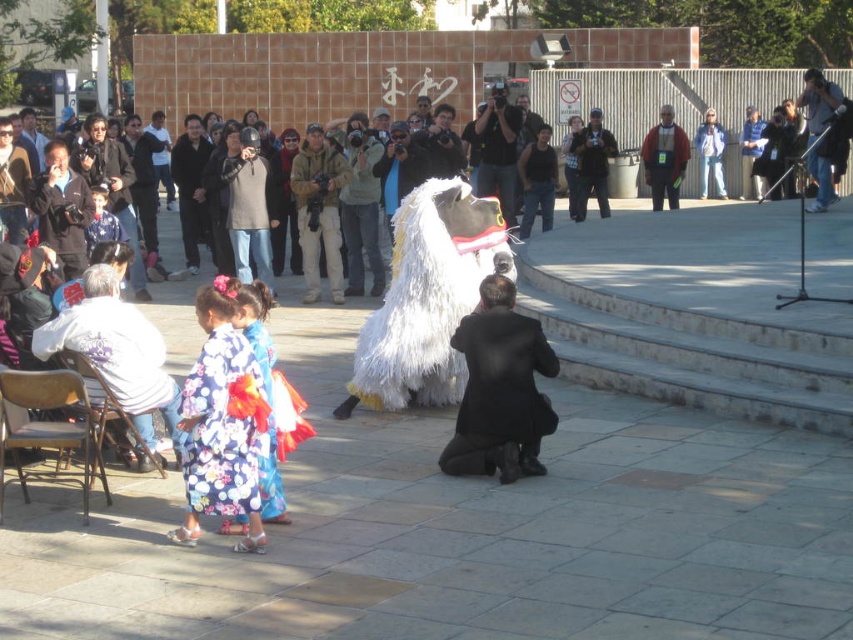
Is white fluffy animal at center shorter than matte black jacket at upper right?

No.

Which is in front, point (451, 378) or point (650, 173)?

Point (451, 378) is more forward.

Locate an element on the screen. Image resolution: width=853 pixels, height=640 pixels. white fluffy animal at center is located at coordinates (426, 298).

This screenshot has height=640, width=853. Identify the location of white fluffy animal at center. (426, 298).

Who is lower down, floral silk kimono at center or matte black jacket at upper right?

floral silk kimono at center

Can you confirm if floral silk kimono at center is positioned below matte black jacket at upper right?

Yes, floral silk kimono at center is below matte black jacket at upper right.

This screenshot has width=853, height=640. Find the location of `floral silk kimono at center`. floral silk kimono at center is located at coordinates click(x=224, y=428).

Identify the location of floral silk kimono at center. The height and width of the screenshot is (640, 853). (224, 428).

How distant is wooden folding chair at lower left from matte black jacket at upper right?

wooden folding chair at lower left is 15.14 meters away from matte black jacket at upper right.

Between wooden folding chair at lower left and matte black jacket at upper right, which one is positioned lower?

Positioned lower is wooden folding chair at lower left.

Which is in front, point (140, 470) or point (679, 161)?

Point (140, 470) is more forward.

At what (x,y) coordinates should I click in order to perform the action: click on wooden folding chair at lower left. Please return your answer as a coordinate pair (x, y). Looking at the image, I should click on (111, 413).